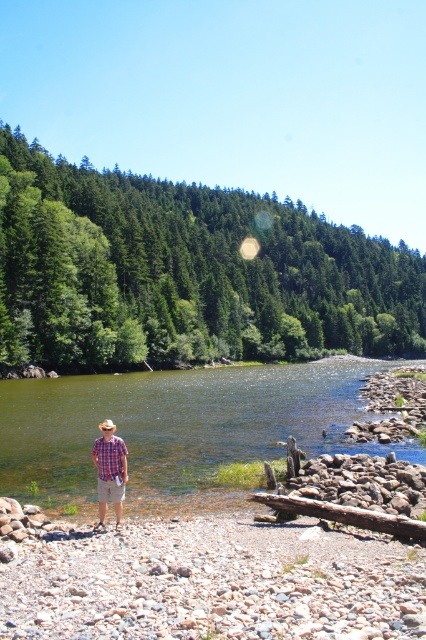
Question: Which of the following is the farthest from the observer?

Choices:
 (A) (109, 461)
 (B) (370, 452)

Answer: (B)

Question: Which object is farther from the camera taking this photo?

Choices:
 (A) plaid cotton shirt at center
 (B) green smooth water at center

Answer: (B)

Question: Can you confirm if green smooth water at center is thinner than plaid cotton shirt at center?

Choices:
 (A) yes
 (B) no

Answer: (B)

Question: Which of the following is the farthest from the observer?

Choices:
 (A) (144, 387)
 (B) (115, 467)

Answer: (A)

Question: Is green smooth water at center smaller than plaid cotton shirt at center?

Choices:
 (A) yes
 (B) no

Answer: (B)

Question: In this image, where is green smooth water at center located relative to plaid cotton shirt at center?

Choices:
 (A) right
 (B) left

Answer: (B)